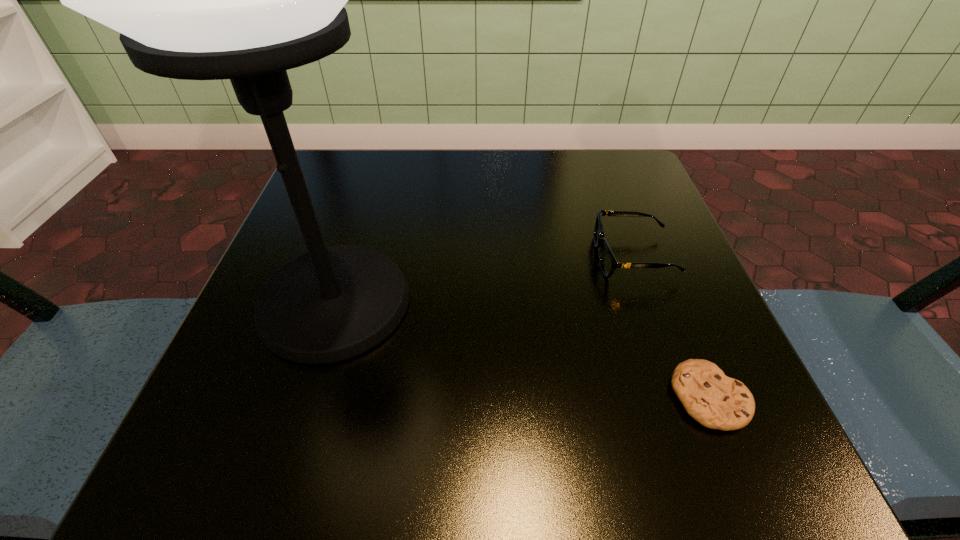
Locate an element on the screen. The height and width of the screenshot is (540, 960). object that is the closest one to the second tallest object is located at coordinates (716, 401).

What are the coordinates of `free space that satisfies the following two spatial constraints: 1. on the front-facing side of the sunglasses; 2. on the left side of the shortest object` in the screenshot? It's located at (684, 398).

The image size is (960, 540). What are the coordinates of `free space that satisfies the following two spatial constraints: 1. on the front-facing side of the second tallest object; 2. on the left side of the cookie` in the screenshot? It's located at (684, 398).

Find the location of a particular element. The width and height of the screenshot is (960, 540). vacant area that satisfies the following two spatial constraints: 1. on the front-facing side of the sunglasses; 2. on the back side of the shortest object is located at coordinates (684, 398).

Where is `vacant area in the image that satisfies the following two spatial constraints: 1. on the front-facing side of the shortest object; 2. on the right side of the second shortest object`? vacant area in the image that satisfies the following two spatial constraints: 1. on the front-facing side of the shortest object; 2. on the right side of the second shortest object is located at coordinates tap(684, 398).

Identify the location of free region that satisfies the following two spatial constraints: 1. on the front-facing side of the second shortest object; 2. on the front side of the leftmost object. The image size is (960, 540). (650, 303).

You are a GUI agent. You are given a task and a screenshot of the screen. Output one action in this format:
    pyautogui.click(x=<x>, y=<y>)
    Task: Click on the free region that satisfies the following two spatial constraints: 1. on the front-facing side of the cookie; 2. on the right side of the sunglasses
    This screenshot has height=540, width=960.
    Given the screenshot: What is the action you would take?
    pyautogui.click(x=684, y=398)

Locate an element on the screen. The width and height of the screenshot is (960, 540). free location that satisfies the following two spatial constraints: 1. on the back side of the shortest object; 2. on the front-facing side of the sunglasses is located at coordinates (653, 256).

Identify the location of free location that satisfies the following two spatial constraints: 1. on the front-facing side of the sunglasses; 2. on the left side of the shortest object. (x=684, y=398).

Identify the location of free space that satisfies the following two spatial constraints: 1. on the front-facing side of the cookie; 2. on the right side of the sunglasses. (684, 398).